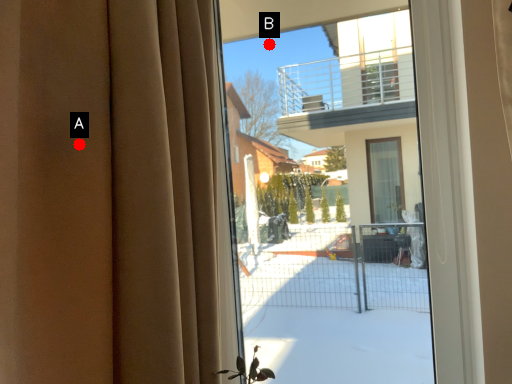
Question: Two points are circled on the image, labeled by A and B beside each circle. Among these points, which one is nearest to the camera?

Choices:
 (A) A is closer
 (B) B is closer

Answer: (A)